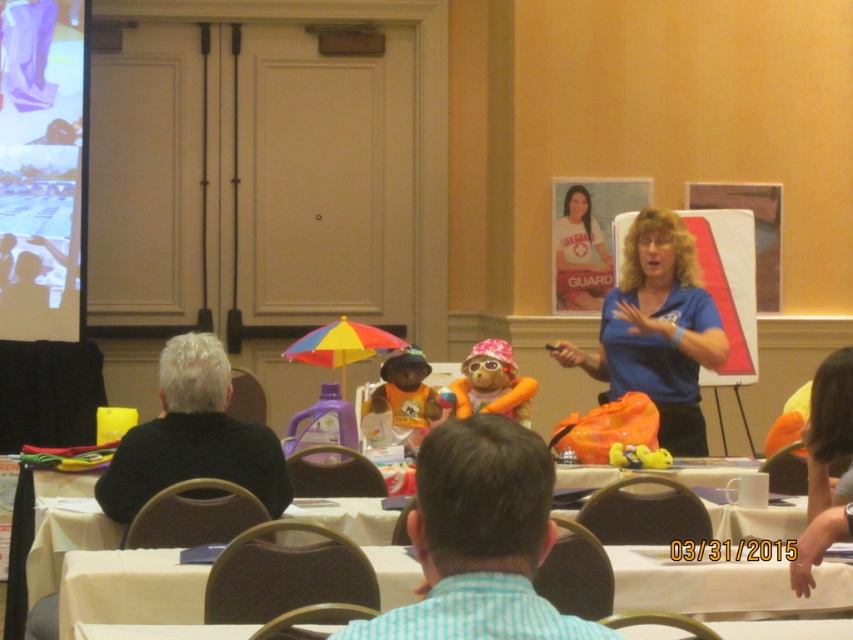
Between blue fabric shirt at center and rainbow fabric umbrella at center, which one has more height?

With more height is blue fabric shirt at center.

Between point (618, 330) and point (323, 330), which one is positioned behind?

Point (618, 330)

Which is in front, point (680, 285) or point (329, 356)?

Positioned in front is point (680, 285).

The image size is (853, 640). Identify the location of blue fabric shirt at center. (657, 330).

In the scene shown: Which of these two, white tablecloth at center or black sweater at left, stands shorter?

white tablecloth at center

Who is more distant from viewer, [758,572] or [202,381]?

The point [202,381] is behind.

Is point (659, 548) positioned in front of point (186, 369)?

Yes.

This screenshot has width=853, height=640. What are the coordinates of `white tablecloth at center` in the screenshot? It's located at (718, 584).

Who is taller, blue striped shirt at center or orange plush bear at center?

orange plush bear at center

Image resolution: width=853 pixels, height=640 pixels. In order to click on blue striped shirt at center in this screenshot , I will do `click(479, 540)`.

Is point (434, 557) more distant than point (402, 416)?

No, it is in front of (402, 416).

This screenshot has height=640, width=853. Find the location of `blue striped shirt at center`. blue striped shirt at center is located at coordinates (479, 540).